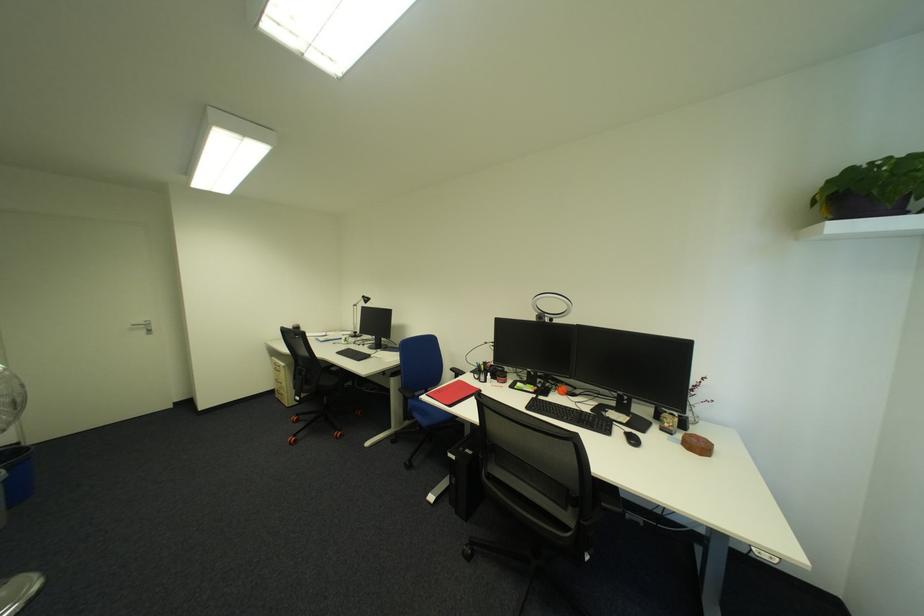
Find where to resting arm the chair armrest. Please return your answer as a coordinate pair (x, y).

(456, 371)